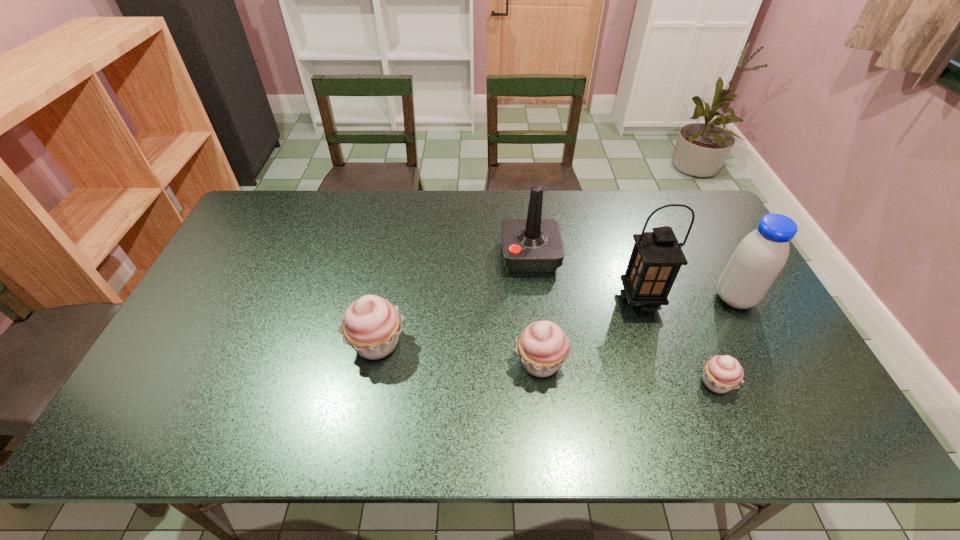
The image size is (960, 540). Identify the location of the leftmost cupcake. (371, 325).

Where is `the second shortest object`? The height and width of the screenshot is (540, 960). the second shortest object is located at coordinates (542, 346).

Image resolution: width=960 pixels, height=540 pixels. In order to click on the second tallest cupcake in this screenshot , I will do tap(542, 346).

Identify the location of the second object from right to left. The height and width of the screenshot is (540, 960). (722, 373).

Identify the location of the shortest object. (722, 373).

This screenshot has width=960, height=540. Find the location of `joystick`. joystick is located at coordinates (533, 245).

You are a GUI agent. You are given a task and a screenshot of the screen. Output one action in this format:
    pyautogui.click(x=<x>, y=<y>)
    Task: Click on the lantern
    
    Given the screenshot: What is the action you would take?
    pyautogui.click(x=656, y=258)

Where is `the tallest object`? the tallest object is located at coordinates [656, 258].

Locate an element on the screen. the rightmost object is located at coordinates point(759,258).

The height and width of the screenshot is (540, 960). What are the coordinates of `blank area located on the right of the leftmost cupcake` in the screenshot? It's located at (495, 343).